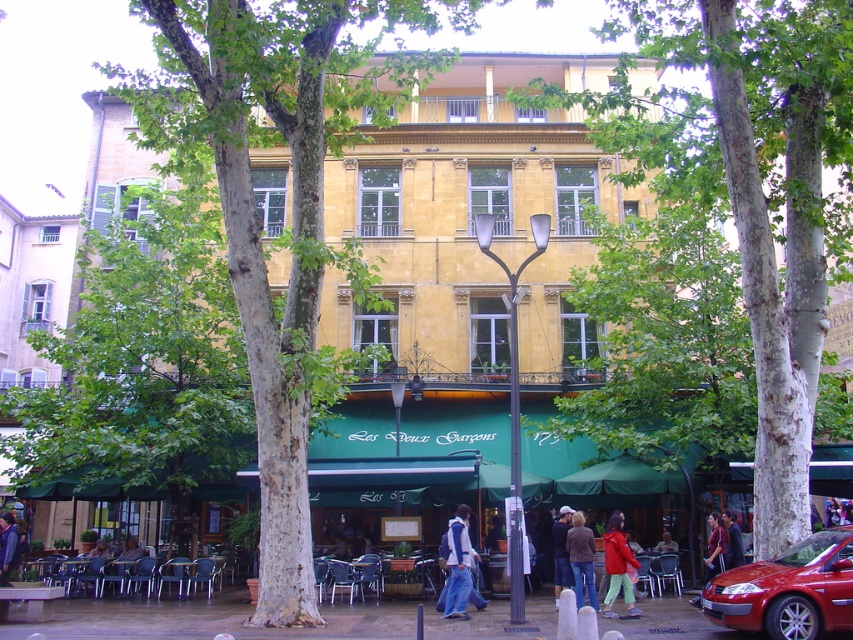
Can you confirm if denim jacket at center is positioned to the right of dark brown leather jacket at center?

In fact, denim jacket at center is to the left of dark brown leather jacket at center.

Which of these two, denim jacket at center or dark brown leather jacket at center, stands taller?

dark brown leather jacket at center is taller.

This screenshot has width=853, height=640. Find the location of `denim jacket at center`. denim jacket at center is located at coordinates [457, 564].

Is green leafy tree at center bigger than dark blue jeans at center?

Yes.

Can you confirm if green leafy tree at center is positioned above dark blue jeans at center?

Yes.

Describe the element at coordinates (291, 200) in the screenshot. I see `green leafy tree at center` at that location.

Where is `green leafy tree at center`? This screenshot has width=853, height=640. green leafy tree at center is located at coordinates (291, 200).

Is point (611, 515) positioned after point (561, 525)?

Yes, point (611, 515) is farther from viewer.

Can you confirm if matte red jacket at center is taller than dark blue jeans at center?

Incorrect, matte red jacket at center's height is not larger of dark blue jeans at center's.

Find the location of `matte red jacket at center`. matte red jacket at center is located at coordinates (618, 566).